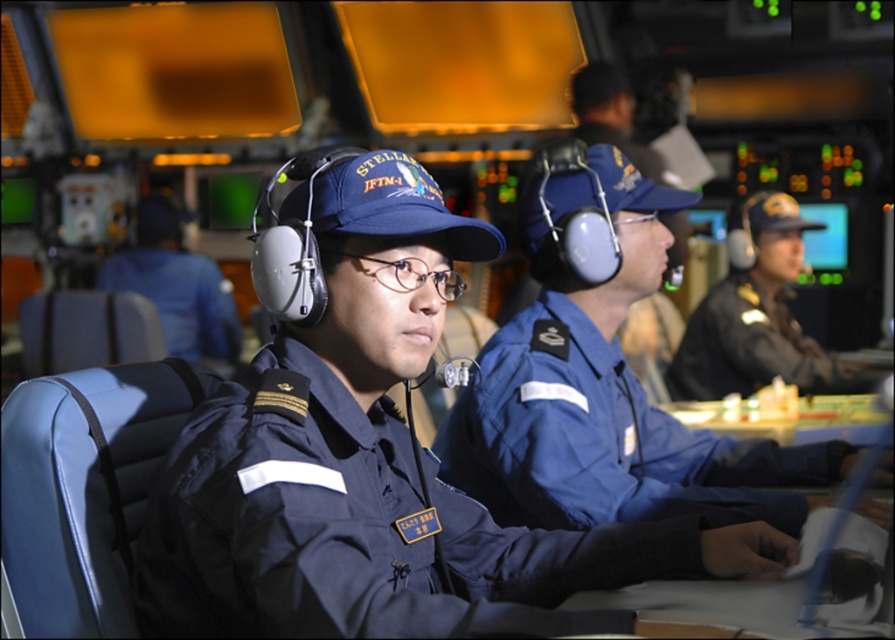
Which is in front, point (559, 540) or point (547, 401)?

Positioned in front is point (559, 540).

Is point (627, 620) farther from camera compared to point (533, 516)?

No, it is not.

Image resolution: width=895 pixels, height=640 pixels. In order to click on navy blue uniform at center in this screenshot , I will do `click(356, 529)`.

The height and width of the screenshot is (640, 895). What are the coordinates of `navy blue uniform at center` in the screenshot? It's located at (356, 529).

Who is positioned more to the left, navy blue uniform at center or blue uniform at center?

blue uniform at center is more to the left.

From the picture: Does navy blue uniform at center have a greater width compared to blue uniform at center?

Yes.

Which is behind, point (355, 452) or point (133, 278)?

The point (133, 278) is behind.

Locate an element on the screen. The height and width of the screenshot is (640, 895). navy blue uniform at center is located at coordinates (356, 529).

Is point (471, 474) farther from camera compared to point (179, 221)?

No, it is in front of (179, 221).

Is blue fabric uniform at center smaller than blue uniform at center?

Actually, blue fabric uniform at center might be larger than blue uniform at center.

Locate an element on the screen. This screenshot has height=640, width=895. blue fabric uniform at center is located at coordinates (604, 440).

At what (x,y) coordinates should I click in order to perform the action: click on blue fabric uniform at center. Please return your answer as a coordinate pair (x, y). The height and width of the screenshot is (640, 895). Looking at the image, I should click on (604, 440).